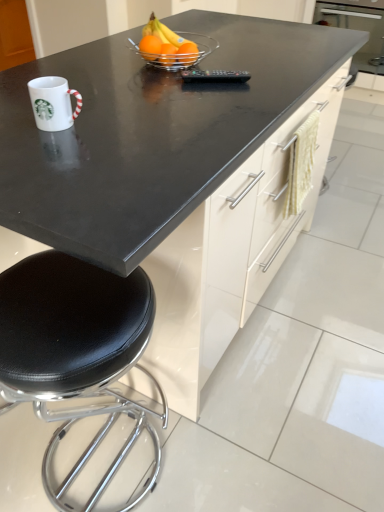
Locate an element on the screen. translucent glass bowl at center is located at coordinates (172, 46).

What do you see at coordinates (168, 54) in the screenshot? I see `orange matte at center, arranged as the second orange when viewed from the right` at bounding box center [168, 54].

This screenshot has height=512, width=384. Describe the element at coordinates (53, 103) in the screenshot. I see `white glossy mug at left` at that location.

Locate an element on the screen. orange matte at center, acting as the third orange starting from the right is located at coordinates (150, 47).

The image size is (384, 512). What do you see at coordinates (188, 53) in the screenshot?
I see `orange matte at center, positioned as the 1th orange in right-to-left order` at bounding box center [188, 53].

What is the approximate height of black plastic remote at center?

black plastic remote at center is 1.32 inches in height.

This screenshot has height=512, width=384. I want to click on translucent glass bowl at center, so click(172, 46).

Are orange matte at center, which ranks as the 1th orange in left-to-right order, and orange matte at center, acting as the third orange starting from the left, beside each other?

Yes, orange matte at center, which ranks as the 1th orange in left-to-right order, and orange matte at center, acting as the third orange starting from the left, clearly make contact.

From a real-world perspective, is orange matte at center, which ranks as the 1th orange in left-to-right order, physically located above or below orange matte at center, acting as the third orange starting from the left?

orange matte at center, which ranks as the 1th orange in left-to-right order, is situated lower than orange matte at center, acting as the third orange starting from the left, in the real world.

Is orange matte at center, which ranks as the 1th orange in left-to-right order, not within orange matte at center, acting as the third orange starting from the left?

Indeed, orange matte at center, which ranks as the 1th orange in left-to-right order, is completely outside orange matte at center, acting as the third orange starting from the left.

Can you confirm if orange matte at center, which ranks as the 1th orange in left-to-right order, is shorter than orange matte at center, acting as the third orange starting from the left?

No.

In the image, is orange matte at center, acting as the third orange starting from the left, on the left side or the right side of black glossy countertop at center?

orange matte at center, acting as the third orange starting from the left, is to the right of black glossy countertop at center.

Is orange matte at center, acting as the third orange starting from the left, positioned far away from black glossy countertop at center?

orange matte at center, acting as the third orange starting from the left, is near black glossy countertop at center, not far away.

Considering the sizes of orange matte at center, positioned as the 1th orange in right-to-left order, and black glossy countertop at center in the image, is orange matte at center, positioned as the 1th orange in right-to-left order, wider or thinner than black glossy countertop at center?

Clearly, orange matte at center, positioned as the 1th orange in right-to-left order, has less width compared to black glossy countertop at center.

Between orange matte at center, positioned as the 1th orange in right-to-left order, and black glossy countertop at center, which one has more height?

With more height is black glossy countertop at center.

Is black plastic remote at center placed right next to orange matte at center, acting as the third orange starting from the right?

No, black plastic remote at center is not touching orange matte at center, acting as the third orange starting from the right.

Which is more distant, (226, 77) or (152, 35)?

The point (152, 35) is more distant.

From the image's perspective, would you say black plastic remote at center is shown under orange matte at center, acting as the third orange starting from the right?

Yes, from the image's perspective, black plastic remote at center is below orange matte at center, acting as the third orange starting from the right.

How distant is orange matte at center, acting as the third orange starting from the right, from translucent glass bowl at center?

orange matte at center, acting as the third orange starting from the right, is 3.05 inches from translucent glass bowl at center.

Image resolution: width=384 pixels, height=512 pixels. I want to click on the 2nd orange below the translucent glass bowl at center (from a real-world perspective), so click(150, 47).

How many degrees apart are the facing directions of orange matte at center, which ranks as the 1th orange in left-to-right order, and translucent glass bowl at center?

The angular difference between orange matte at center, which ranks as the 1th orange in left-to-right order, and translucent glass bowl at center is 0.439 degrees.

Looking at this image, from a real-world perspective, is orange matte at center, acting as the third orange starting from the right, located higher than translucent glass bowl at center?

No, from a real-world perspective, orange matte at center, acting as the third orange starting from the right, is not on top of translucent glass bowl at center.

Considering the sizes of translucent glass bowl at center and black leather stool at lower left in the image, is translucent glass bowl at center taller or shorter than black leather stool at lower left?

Considering their sizes, translucent glass bowl at center has less height than black leather stool at lower left.

Which object is closer to the camera taking this photo, translucent glass bowl at center or black leather stool at lower left?

black leather stool at lower left is more forward.

Considering the relative sizes of translucent glass bowl at center and black leather stool at lower left in the image provided, is translucent glass bowl at center wider than black leather stool at lower left?

In fact, translucent glass bowl at center might be narrower than black leather stool at lower left.

Which of these two, translucent glass bowl at center or orange matte at center, which ranks as the 1th orange in left-to-right order, stands taller?

Standing taller between the two is translucent glass bowl at center.

Identify the location of fruit dish above the orange matte at center, acting as the third orange starting from the right (from the image's perspective). The width and height of the screenshot is (384, 512). (172, 46).

Which is behind, point (199, 41) or point (142, 42)?

The point (199, 41) is more distant.

How different are the orientations of translucent glass bowl at center and orange matte at center, which ranks as the 1th orange in left-to-right order, in degrees?

They differ by 0.439 degrees in their facing directions.

From the image's perspective, is black leather stool at lower left above translucent glass bowl at center?

No, from the image's perspective, black leather stool at lower left is not over translucent glass bowl at center.

Who is shorter, black leather stool at lower left or translucent glass bowl at center?

Standing shorter between the two is translucent glass bowl at center.

Between black leather stool at lower left and translucent glass bowl at center, which one is positioned behind?

translucent glass bowl at center is further from the camera.

Is point (69, 320) in front of point (152, 23)?

Yes.

Where is `the 2nd orange above the orange matte at center, acting as the third orange starting from the left (from the image's perspective)`? The image size is (384, 512). the 2nd orange above the orange matte at center, acting as the third orange starting from the left (from the image's perspective) is located at coordinates (150, 47).

This screenshot has width=384, height=512. Identify the location of countertop located below the orange matte at center, positioned as the 1th orange in right-to-left order (from the image's perspective). (150, 133).

Based on their spatial positions, is white glossy mug at left or orange matte at center, positioned as the 1th orange in right-to-left order, further from black leather stool at lower left?

Among the two, orange matte at center, positioned as the 1th orange in right-to-left order, is located further to black leather stool at lower left.

Estimate the real-world distances between objects in this image. Which object is closer to black leather stool at lower left, orange matte at center, acting as the third orange starting from the right, or translucent glass bowl at center?

translucent glass bowl at center.

Which object lies further to the anchor point black glossy countertop at center, orange matte at center, which ranks as the 1th orange in left-to-right order, or black plastic remote at center?

Among the two, orange matte at center, which ranks as the 1th orange in left-to-right order, is located further to black glossy countertop at center.

Which object lies nearer to the anchor point black glossy countertop at center, orange matte at center, acting as the 2th orange starting from the left, or translucent glass bowl at center?

Based on the image, translucent glass bowl at center appears to be nearer to black glossy countertop at center.

Looking at the image, which one is located further to white glossy mug at left, orange matte at center, acting as the third orange starting from the left, or black plastic remote at center?

orange matte at center, acting as the third orange starting from the left, is positioned further to the anchor white glossy mug at left.

Looking at the image, which one is located further to black plastic remote at center, translucent glass bowl at center or black glossy countertop at center?

black glossy countertop at center is further to black plastic remote at center.

From the image, which object appears to be farther from black glossy countertop at center, black plastic remote at center or orange matte at center, which ranks as the 1th orange in left-to-right order?

orange matte at center, which ranks as the 1th orange in left-to-right order.

Considering their positions, is translucent glass bowl at center positioned further to orange matte at center, which ranks as the 1th orange in left-to-right order, than orange matte at center, arranged as the second orange when viewed from the right?

Based on the image, translucent glass bowl at center appears to be further to orange matte at center, which ranks as the 1th orange in left-to-right order.

Locate an element on the screen. This screenshot has width=384, height=512. countertop between black plastic remote at center and black leather stool at lower left in the vertical direction is located at coordinates pyautogui.click(x=150, y=133).

Find the location of a particular element. The width and height of the screenshot is (384, 512). fruit dish between orange matte at center, which ranks as the 1th orange in left-to-right order, and orange matte at center, positioned as the 1th orange in right-to-left order is located at coordinates (172, 46).

Identify the location of coffee cup located between black glossy countertop at center and orange matte at center, positioned as the 1th orange in right-to-left order, in the depth direction. The height and width of the screenshot is (512, 384). (53, 103).

Locate an element on the screen. The image size is (384, 512). appliance that lies between orange matte at center, which ranks as the 1th orange in left-to-right order, and black leather stool at lower left from top to bottom is located at coordinates (214, 76).